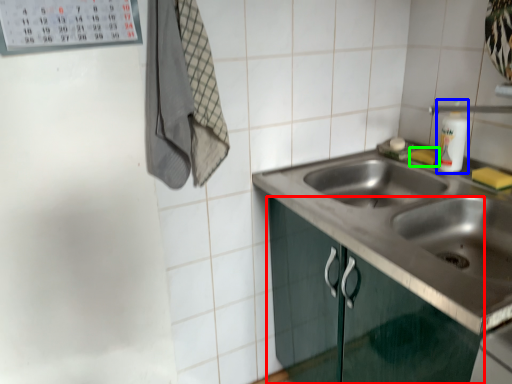
Question: Considering the real-world distances, which object is farthest from cabinetry (highlighted by a red box)? bottle (highlighted by a blue box) or soap (highlighted by a green box)?

Choices:
 (A) bottle
 (B) soap

Answer: (B)